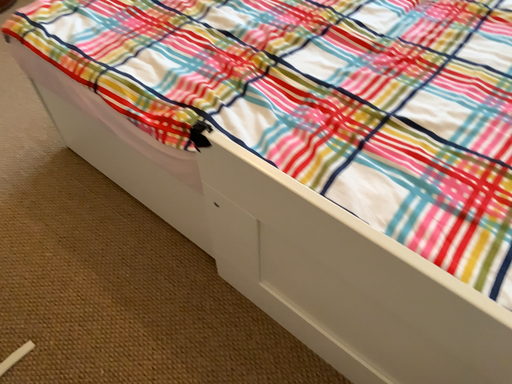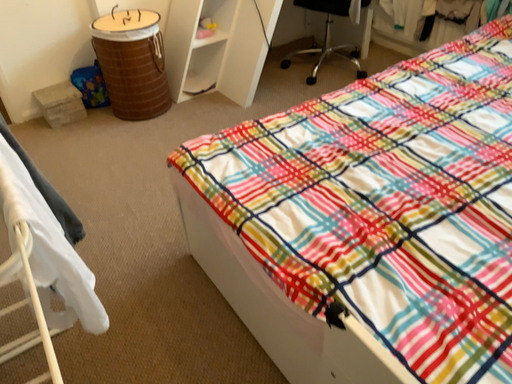
Question: Which way did the camera rotate in the video?

Choices:
 (A) rotated upward
 (B) rotated downward

Answer: (A)